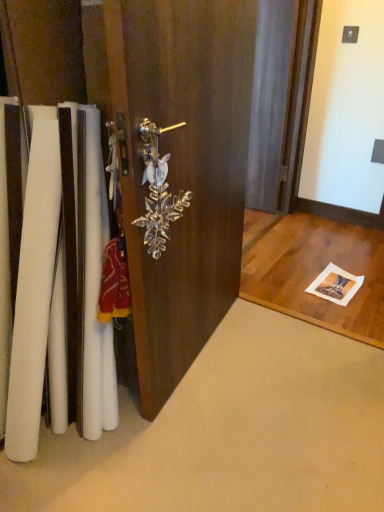
Question: Is clear glass snowflake at center next to clear crystal snowflake at center?

Choices:
 (A) yes
 (B) no

Answer: (B)

Question: Is clear glass snowflake at center to the left of clear crystal snowflake at center from the viewer's perspective?

Choices:
 (A) no
 (B) yes

Answer: (A)

Question: Is clear glass snowflake at center in front of clear crystal snowflake at center?

Choices:
 (A) yes
 (B) no

Answer: (A)

Question: Considering the relative sizes of clear glass snowflake at center and clear crystal snowflake at center in the image provided, is clear glass snowflake at center thinner than clear crystal snowflake at center?

Choices:
 (A) no
 (B) yes

Answer: (A)

Question: Considering the relative sizes of clear glass snowflake at center and clear crystal snowflake at center in the image provided, is clear glass snowflake at center shorter than clear crystal snowflake at center?

Choices:
 (A) no
 (B) yes

Answer: (A)

Question: From the image's perspective, is clear glass snowflake at center located above clear crystal snowflake at center?

Choices:
 (A) no
 (B) yes

Answer: (B)

Question: Is clear crystal snowflake at center to the right of clear glass snowflake at center from the viewer's perspective?

Choices:
 (A) yes
 (B) no

Answer: (B)

Question: Can you confirm if clear crystal snowflake at center is smaller than clear glass snowflake at center?

Choices:
 (A) no
 (B) yes

Answer: (B)

Question: Considering the relative sizes of clear crystal snowflake at center and clear glass snowflake at center in the image provided, is clear crystal snowflake at center wider than clear glass snowflake at center?

Choices:
 (A) yes
 (B) no

Answer: (B)

Question: From the image's perspective, is clear crystal snowflake at center above clear glass snowflake at center?

Choices:
 (A) yes
 (B) no

Answer: (B)

Question: Is clear crystal snowflake at center placed right next to clear glass snowflake at center?

Choices:
 (A) no
 (B) yes

Answer: (A)

Question: From the image's perspective, is clear crystal snowflake at center beneath clear glass snowflake at center?

Choices:
 (A) yes
 (B) no

Answer: (A)

Question: From a real-world perspective, is clear glass snowflake at center physically located above or below clear crystal snowflake at center?

Choices:
 (A) below
 (B) above

Answer: (A)